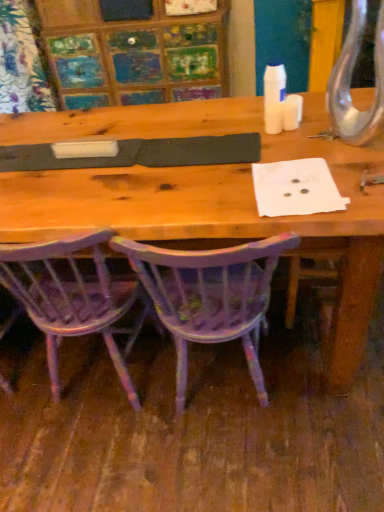
Question: Is purple painted wood chair at lower center, acting as the first chair starting from the left, to the left of purple painted wood chair at center, arranged as the 1th chair when viewed from the right, from the viewer's perspective?

Choices:
 (A) no
 (B) yes

Answer: (B)

Question: From the image's perspective, is purple painted wood chair at lower center, acting as the first chair starting from the left, over purple painted wood chair at center, arranged as the 1th chair when viewed from the right?

Choices:
 (A) no
 (B) yes

Answer: (B)

Question: From the image's perspective, is purple painted wood chair at lower center, marked as the 2th chair in a right-to-left arrangement, below purple painted wood chair at center, which is the 2th chair in left-to-right order?

Choices:
 (A) no
 (B) yes

Answer: (A)

Question: Does purple painted wood chair at lower center, marked as the 2th chair in a right-to-left arrangement, contain purple painted wood chair at center, arranged as the 1th chair when viewed from the right?

Choices:
 (A) yes
 (B) no

Answer: (B)

Question: Is purple painted wood chair at lower center, acting as the first chair starting from the left, oriented towards purple painted wood chair at center, which is the 2th chair in left-to-right order?

Choices:
 (A) no
 (B) yes

Answer: (A)

Question: Does purple painted wood chair at lower center, marked as the 2th chair in a right-to-left arrangement, have a larger size compared to purple painted wood chair at center, which is the 2th chair in left-to-right order?

Choices:
 (A) no
 (B) yes

Answer: (A)

Question: From the image's perspective, is purple painted wood chair at center, which is the 2th chair in left-to-right order, below purple painted wood chair at lower center, acting as the first chair starting from the left?

Choices:
 (A) yes
 (B) no

Answer: (A)

Question: Considering the relative sizes of purple painted wood chair at center, arranged as the 1th chair when viewed from the right, and purple painted wood chair at lower center, marked as the 2th chair in a right-to-left arrangement, in the image provided, is purple painted wood chair at center, arranged as the 1th chair when viewed from the right, thinner than purple painted wood chair at lower center, marked as the 2th chair in a right-to-left arrangement,?

Choices:
 (A) no
 (B) yes

Answer: (A)

Question: Is purple painted wood chair at center, which is the 2th chair in left-to-right order, to the right of purple painted wood chair at lower center, marked as the 2th chair in a right-to-left arrangement, from the viewer's perspective?

Choices:
 (A) yes
 (B) no

Answer: (A)

Question: Is purple painted wood chair at center, arranged as the 1th chair when viewed from the right, smaller than purple painted wood chair at lower center, acting as the first chair starting from the left?

Choices:
 (A) no
 (B) yes

Answer: (A)

Question: From a real-world perspective, is purple painted wood chair at center, arranged as the 1th chair when viewed from the right, positioned over purple painted wood chair at lower center, marked as the 2th chair in a right-to-left arrangement, based on gravity?

Choices:
 (A) no
 (B) yes

Answer: (A)

Question: Is purple painted wood chair at center, which is the 2th chair in left-to-right order, looking in the opposite direction of purple painted wood chair at lower center, acting as the first chair starting from the left?

Choices:
 (A) no
 (B) yes

Answer: (A)

Question: Considering the relative positions of purple painted wood chair at lower center, acting as the first chair starting from the left, and purple painted wood chair at center, which is the 2th chair in left-to-right order, in the image provided, is purple painted wood chair at lower center, acting as the first chair starting from the left, to the left or to the right of purple painted wood chair at center, which is the 2th chair in left-to-right order,?

Choices:
 (A) right
 (B) left

Answer: (B)